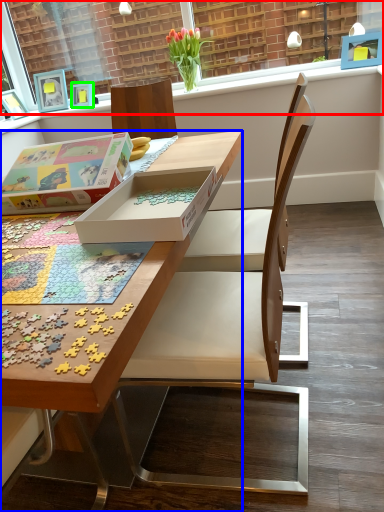
Question: Which object is positioned farthest from window frame (highlighted by a red box)? Select from desk (highlighted by a blue box) and picture frame (highlighted by a green box).

Choices:
 (A) desk
 (B) picture frame

Answer: (A)